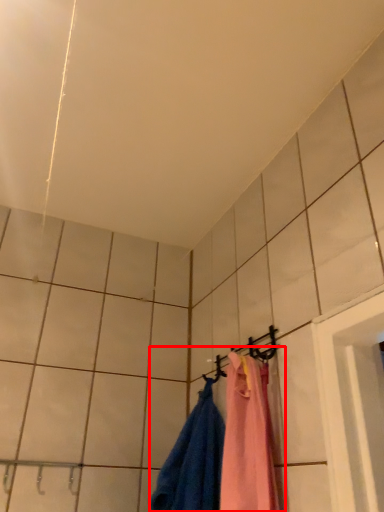
Question: From the image's perspective, what is the correct spatial positioning of laundry (annotated by the red box) in reference to hanger?

Choices:
 (A) below
 (B) above

Answer: (A)